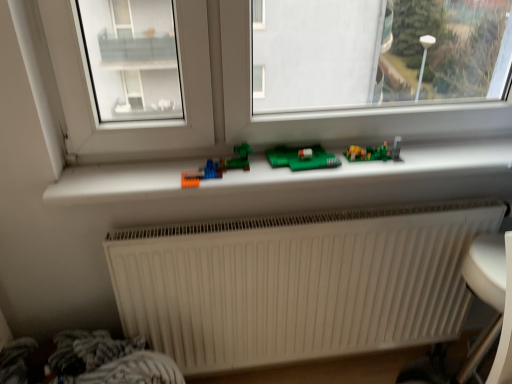
Question: Considering the positions of white plastic window sill at center and white ribbed radiator at lower center in the image, is white plastic window sill at center taller or shorter than white ribbed radiator at lower center?

Choices:
 (A) tall
 (B) short

Answer: (B)

Question: From a real-world perspective, relative to white ribbed radiator at lower center, is white plastic window sill at center vertically above or below?

Choices:
 (A) below
 (B) above

Answer: (B)

Question: Which is nearer to the white plastic window sill at center?

Choices:
 (A) white plastic armchair at lower right
 (B) white ribbed radiator at lower center
 (C) matte plastic toy at center, the 1th toy in the back-to-front sequence
 (D) translucent plastic toy at center, the 2th toy from the right

Answer: (B)

Question: Based on their relative distances, which object is nearer to the matte plastic toy at center, acting as the second toy starting from the front?

Choices:
 (A) white ribbed radiator at lower center
 (B) white plastic armchair at lower right
 (C) translucent plastic toy at center, which ranks as the 2th toy in back-to-front order
 (D) white plastic window sill at center

Answer: (D)